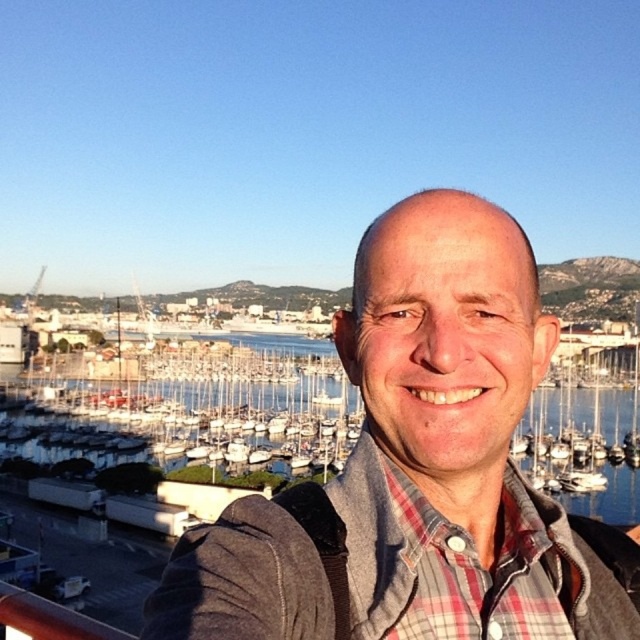
You are a photographer analyzing the composition of this image. The gray fabric jacket at center is positioned at coordinates 0.731 on the x axis and 0.648 on the y axis. Based on the rule of thirds, which divides the image into a 3x3 grid, is the jacket placed along any of the grid lines or intersection points?

The rule of thirds divides the image into a 3x3 grid, creating intersection points at coordinates like approximately (x=426, y=639), etc. The gray fabric jacket at center is located at point (x=413, y=467), which is close to the right and lower intersection points but not exactly on them. Therefore, it is not precisely placed along the rule of thirds grid lines or their intersections.

You are a photographer planning to capture a wide shot of the scene. Given that the gray fabric jacket at center and the blue water at center are both in the frame, which object would appear smaller in the photo?

The gray fabric jacket at center would appear smaller in the photo because it has a smaller size compared to the blue water at center.